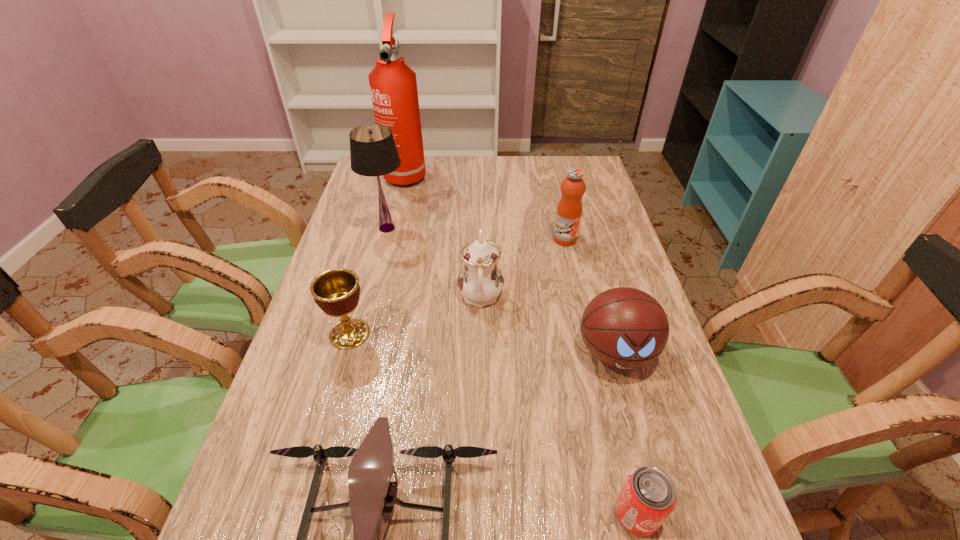
The image size is (960, 540). In order to click on the tallest object in this screenshot , I will do `click(393, 85)`.

At what (x,y) coordinates should I click in order to perform the action: click on the farthest object. Please return your answer as a coordinate pair (x, y). The width and height of the screenshot is (960, 540). Looking at the image, I should click on (393, 85).

Where is `the second tallest object`? The image size is (960, 540). the second tallest object is located at coordinates (373, 152).

Locate an element on the screen. The image size is (960, 540). the third tallest object is located at coordinates (569, 209).

Where is `chinaware`? This screenshot has width=960, height=540. chinaware is located at coordinates (480, 281).

This screenshot has height=540, width=960. I want to click on basketball, so [x=623, y=327].

At what (x,y) coordinates should I click in order to perform the action: click on chalice. Please return your answer as a coordinate pair (x, y). Image resolution: width=960 pixels, height=540 pixels. Looking at the image, I should click on (336, 291).

Locate an element on the screen. This screenshot has width=960, height=540. can is located at coordinates (648, 496).

Where is `vacant space located at the nozzle of the tallest object`? The height and width of the screenshot is (540, 960). vacant space located at the nozzle of the tallest object is located at coordinates (393, 226).

Where is `vacant space located 0.120m on the front-facing side of the lampshade`? Image resolution: width=960 pixels, height=540 pixels. vacant space located 0.120m on the front-facing side of the lampshade is located at coordinates (446, 228).